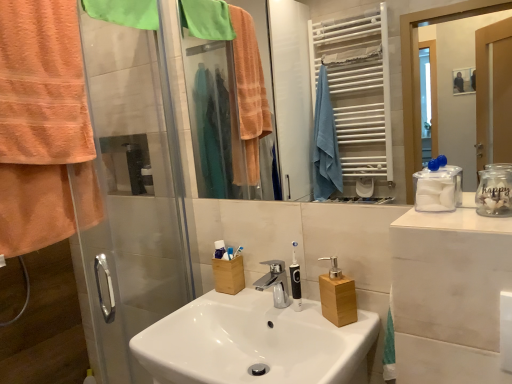
Question: From a real-world perspective, relative to white plastic toothbrush at center, which is counted as the second toothbrush, starting from the left, is white glossy mirror at upper center vertically above or below?

Choices:
 (A) above
 (B) below

Answer: (A)

Question: Is white glossy mirror at upper center taller or shorter than white plastic toothbrush at center, the 1th toothbrush from the right?

Choices:
 (A) tall
 (B) short

Answer: (A)

Question: Which of these objects is positioned farthest from the wooden soap dispenser at center, acting as the first bottle starting from the left?

Choices:
 (A) white ceramic sink at center
 (B) white glossy mirror at upper center
 (C) transparent plastic container at right
 (D) transparent glass shower door at left
 (E) green fabric towel at upper left, the 2th towel/napkin ordered from the bottom

Answer: (B)

Question: Which object is positioned farthest from the matte plastic toothbrushes at center?

Choices:
 (A) clear glass jar at right, placed as the first bottle when sorted from right to left
 (B) orange terry cloth towel at left, the second towel/napkin viewed from the top
 (C) white glossy mirror at upper center
 (D) white plastic toothbrush at center, the 1th toothbrush from the right
 (E) transparent glass shower door at left

Answer: (C)